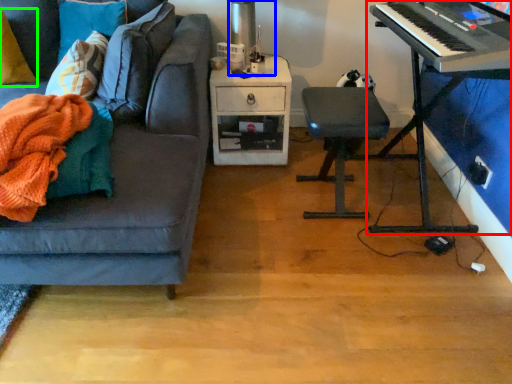
Question: Estimate the real-world distances between objects in this image. Which object is closer to piano (highlighted by a red box), table lamp (highlighted by a blue box) or pillow (highlighted by a green box)?

Choices:
 (A) table lamp
 (B) pillow

Answer: (A)